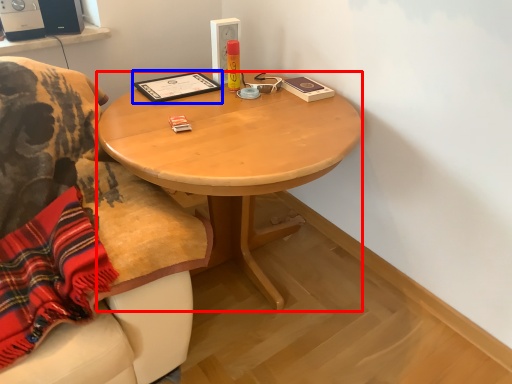
Question: Which of the following is the farthest to the observer, desk (highlighted by a red box) or book (highlighted by a blue box)?

Choices:
 (A) desk
 (B) book

Answer: (B)